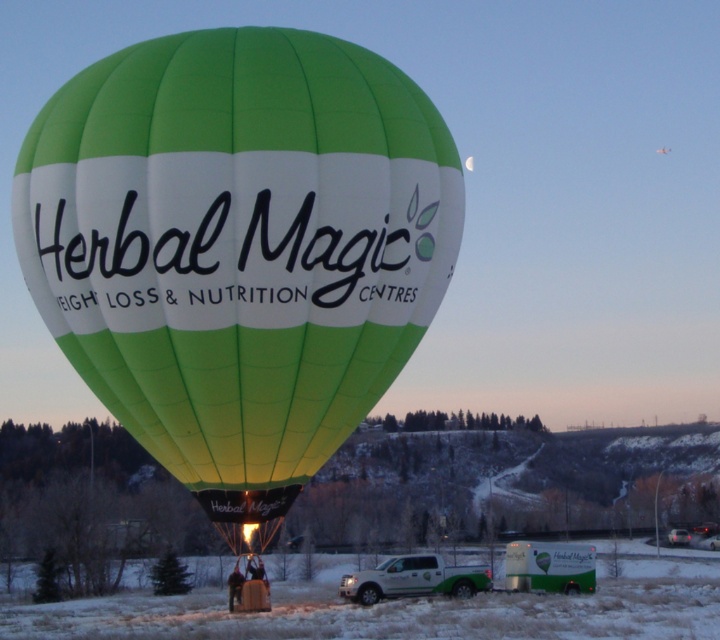
Question: Is green fabric hot air balloon at center positioned before green fabric balloon at center?

Choices:
 (A) no
 (B) yes

Answer: (B)

Question: Is green fabric hot air balloon at center positioned behind green fabric balloon at center?

Choices:
 (A) no
 (B) yes

Answer: (A)

Question: Is green fabric hot air balloon at center to the left of green fabric balloon at center from the viewer's perspective?

Choices:
 (A) no
 (B) yes

Answer: (A)